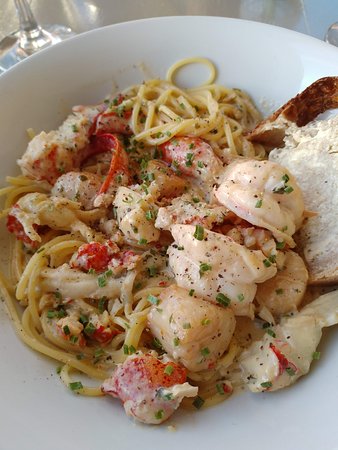
At what (x,y) coordinates should I click in order to perform the action: click on wine glass reflection. Please return your answer as a coordinate pair (x, y). Looking at the image, I should click on (283, 13).